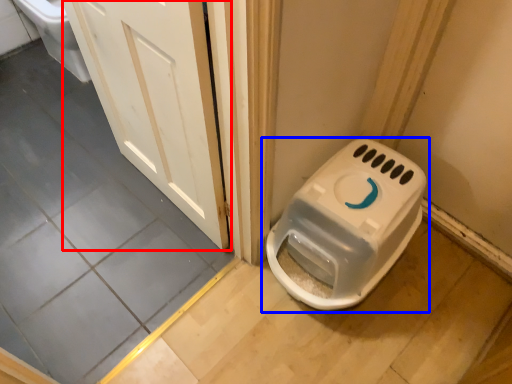
Question: Which of the following is the closest to the observer, door (highlighted by a red box) or toilet (highlighted by a blue box)?

Choices:
 (A) door
 (B) toilet

Answer: (A)